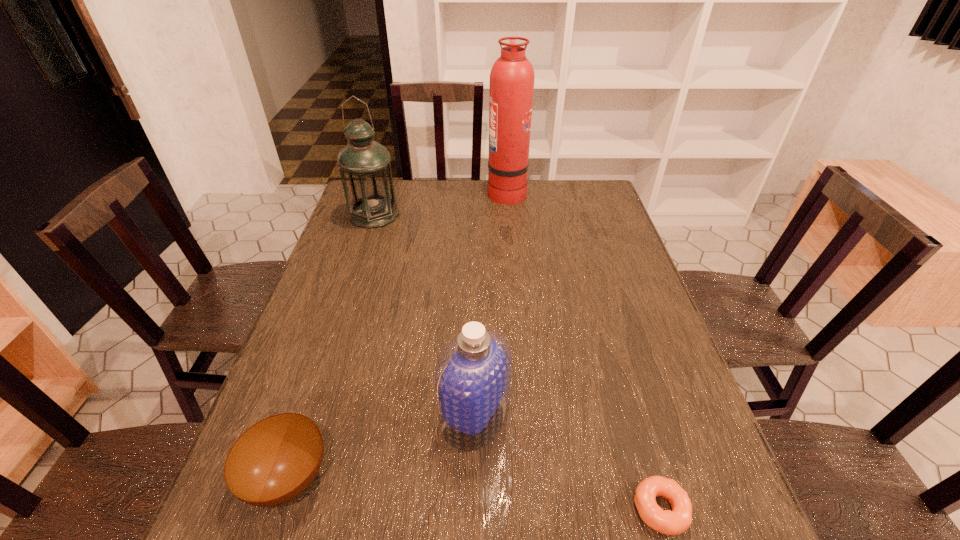
Where is `object present at the near right corner`? object present at the near right corner is located at coordinates (677, 521).

Locate an element on the screen. Image resolution: width=960 pixels, height=540 pixels. vacant space at the far edge of the desktop is located at coordinates (441, 210).

Where is `vacant space at the left edge of the desktop`? vacant space at the left edge of the desktop is located at coordinates (342, 341).

In the image, there is a desktop. Find the location of `free space at the right edge`. free space at the right edge is located at coordinates (696, 435).

The height and width of the screenshot is (540, 960). I want to click on free space between the fire extinguisher and the oil lamp, so click(441, 203).

At what (x,y) coordinates should I click in order to perform the action: click on empty space between the second tallest object and the fire extinguisher. Please return your answer as a coordinate pair (x, y). The width and height of the screenshot is (960, 540). Looking at the image, I should click on (441, 203).

This screenshot has width=960, height=540. Identify the location of free space between the third tallest object and the fire extinguisher. (491, 303).

This screenshot has width=960, height=540. I want to click on vacant region between the oil lamp and the cleansing agent, so click(x=424, y=315).

Find the location of a particular element. The width and height of the screenshot is (960, 540). vacant space that's between the tallest object and the fourth shortest object is located at coordinates (441, 203).

Identify the location of free space between the bowl and the fire extinguisher. (397, 335).